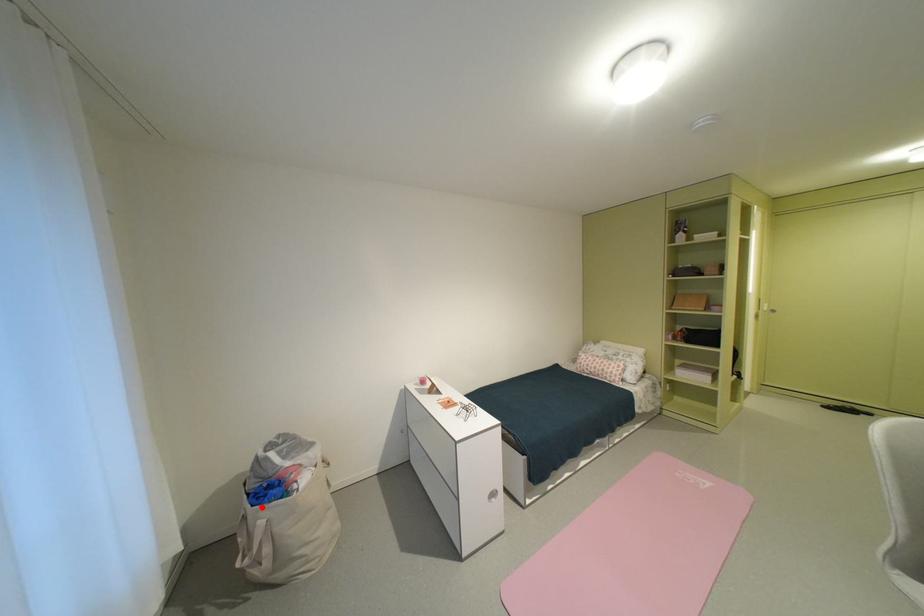
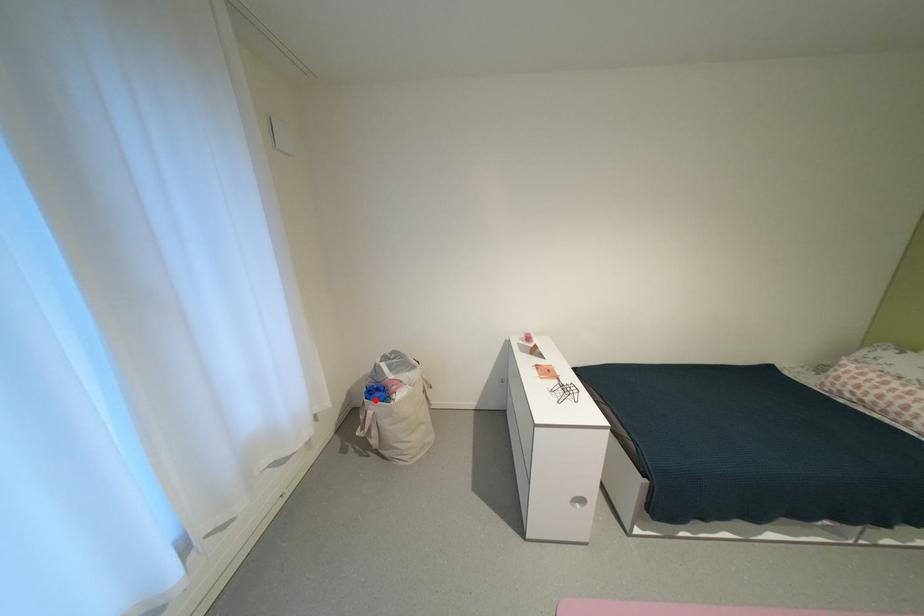
I am providing you with two images of the same scene from different viewpoints. A red point is marked on the first image and another point is marked on the second image. Is the red point in image1 aligned with the point shown in image2?

Yes